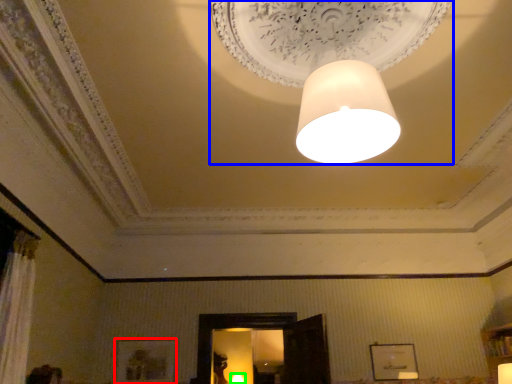
Question: Which is nearer to the picture frame (highlighted by a red box)? lamp (highlighted by a blue box) or lamp (highlighted by a green box).

Choices:
 (A) lamp
 (B) lamp

Answer: (B)